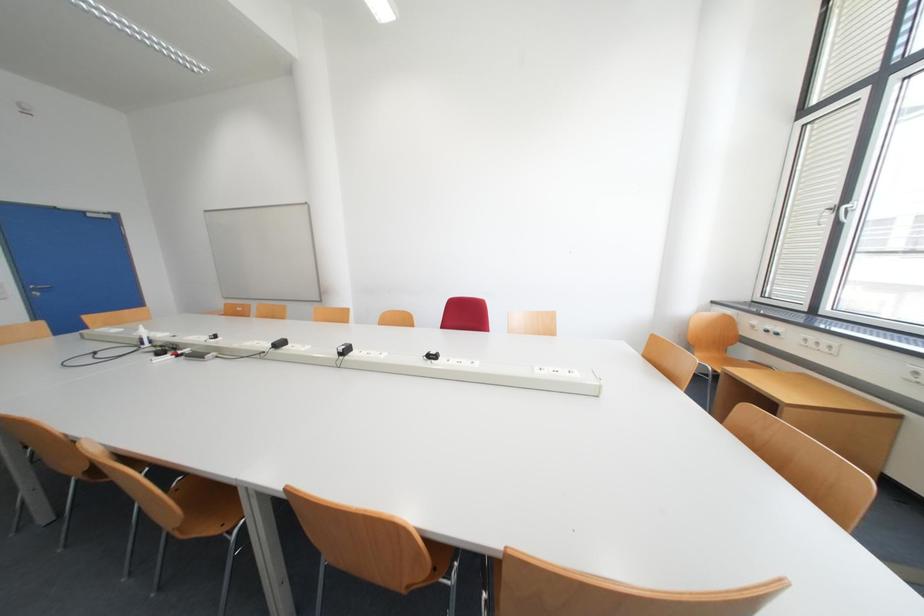
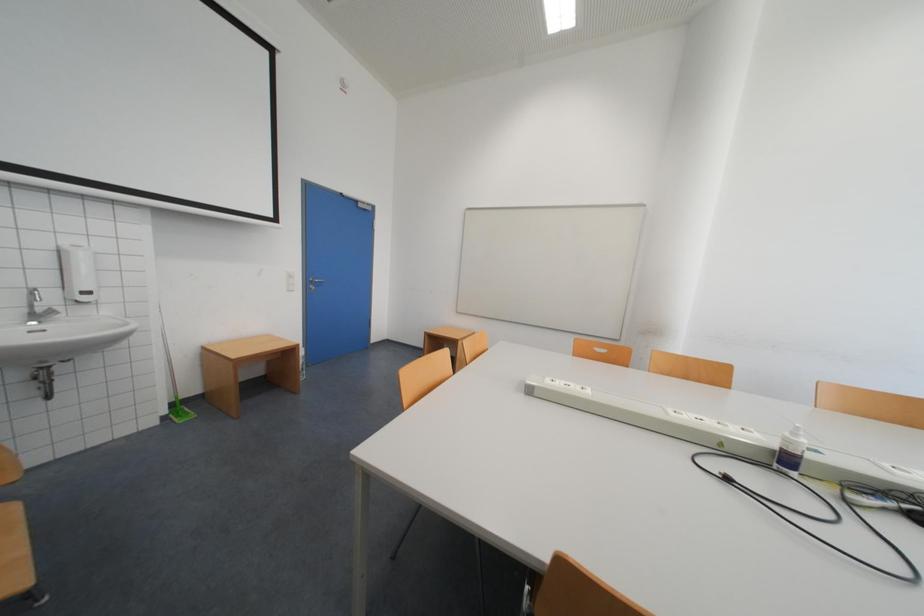
Question: Which direction would the cameraman need to move to produce the second image? Reply with the corresponding letter.

Choices:
 (A) Left
 (B) Right
 (C) Forward
 (D) Backward

Answer: (A)